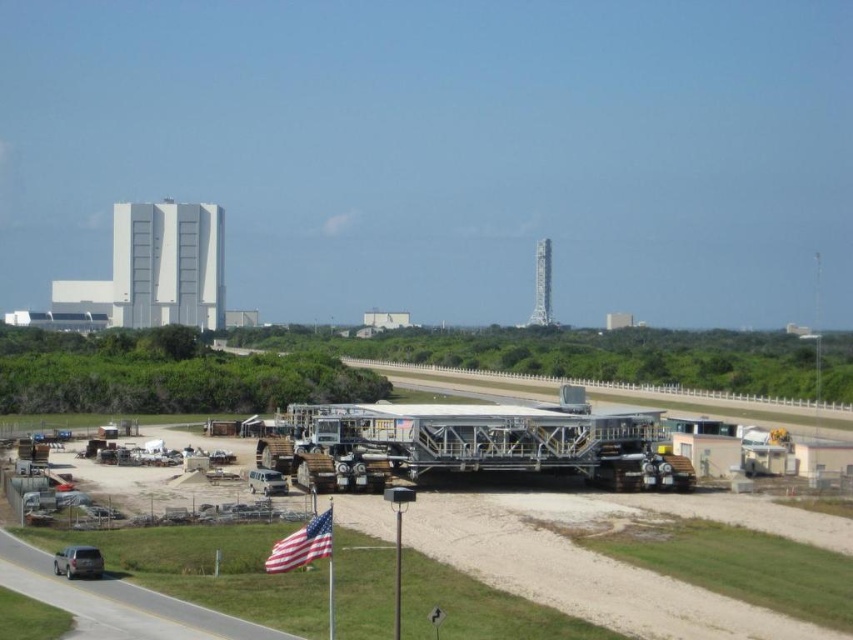
Question: Estimate the real-world distances between objects in this image. Which object is farther from the metallic gray structure at center?

Choices:
 (A) gray asphalt highway at lower left
 (B) american flag at lower center
 (C) metallic silver trailer truck at center

Answer: (A)

Question: Which object is the farthest from the metallic gray structure at center?

Choices:
 (A) gray asphalt highway at lower left
 (B) metallic silver trailer truck at center
 (C) american flag at lower center

Answer: (A)

Question: Can you confirm if gray asphalt highway at lower left is positioned above american flag at lower center?

Choices:
 (A) no
 (B) yes

Answer: (A)

Question: Is american flag at lower center positioned behind sandy beige van at center?

Choices:
 (A) no
 (B) yes

Answer: (A)

Question: Which object is farther from the camera taking this photo?

Choices:
 (A) gray asphalt highway at lower left
 (B) matte gray suv at lower left

Answer: (B)

Question: Considering the relative positions of american flag at lower center and matte gray suv at lower left in the image provided, where is american flag at lower center located with respect to matte gray suv at lower left?

Choices:
 (A) above
 (B) below

Answer: (B)